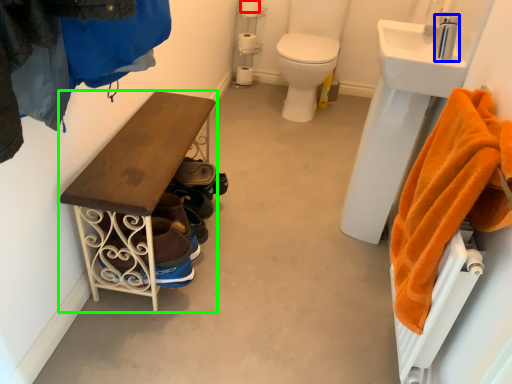
Question: Which object is positioned farthest from toilet paper (highlighted by a red box)? Select from faucet (highlighted by a blue box) and furniture (highlighted by a green box).

Choices:
 (A) faucet
 (B) furniture

Answer: (B)